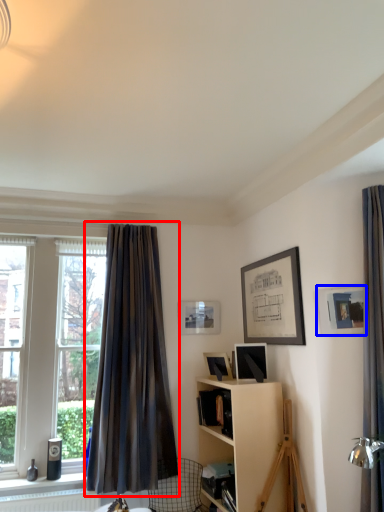
Question: Among these objects, which one is nearest to the camera, curtain (highlighted by a red box) or picture frame (highlighted by a blue box)?

Choices:
 (A) curtain
 (B) picture frame

Answer: (B)